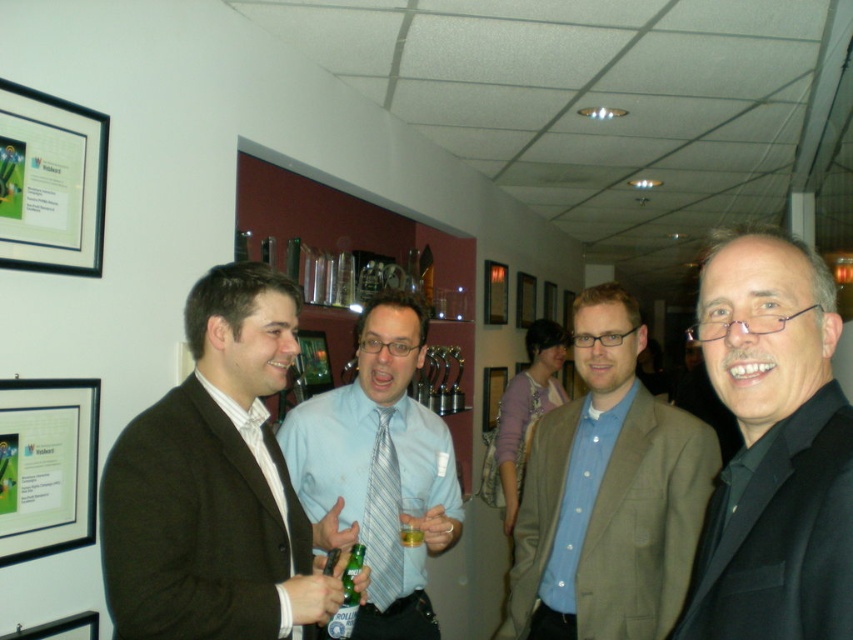
You are a photographer wanting to capture a photo of the brown wool suit at center and the black matte jacket at right. Since you want both items to be in the frame, where should you position yourself relative to the two objects?

You should position yourself to the left of the brown wool suit at center and to the right of the black matte jacket at right so that both items are visible in the frame.

Looking at this image, you are organizing a charity event and need to ensure that the light brown suit at center and the striped fabric tie at center can be displayed together in a showcase. Given that the showcase has a height limit of 1.5 meters, will both items fit without exceeding this limit?

The light brown suit at center has a larger size compared to striped fabric tie at center. Since the showcase has a height limit of 1.5 meters, the larger size of the light brown suit at center would determine if they fit. Assuming the suit can be displayed vertically within the height limit, both items should fit as the tie is smaller and can be placed accordingly.

You are standing in the room and want to locate the light brown suit at center. Based on the coordinates provided, which object is located at point (608, 493)?

The point (608, 493) corresponds to the light brown suit at center.